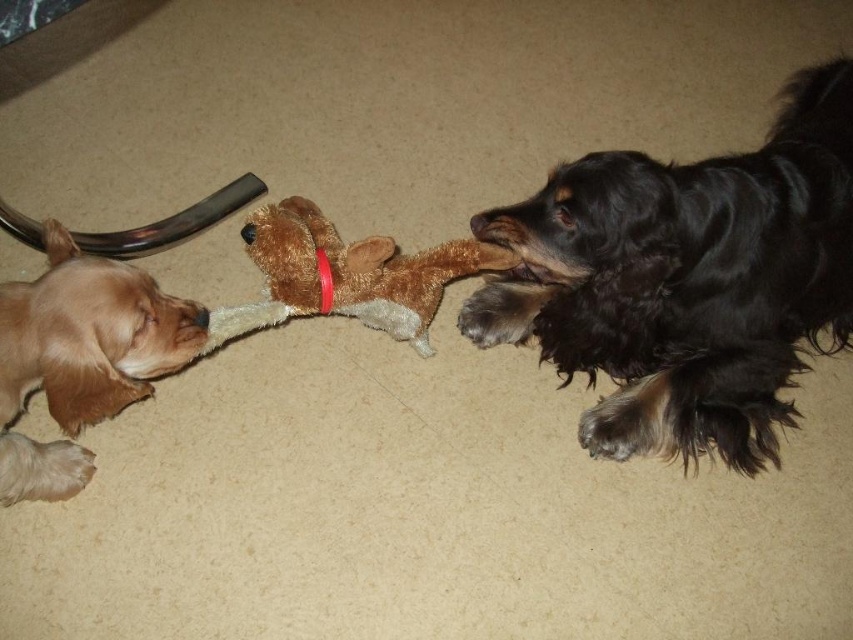
You are standing at the origin point of the coordinate system. You want to throw a treat to the black silky dog at right. What are the coordinates you should aim for?

The coordinates to aim for are 0.438 in the x direction and 0.805 in the y direction.

What are the coordinates of the black silky dog at right?

The black silky dog at right is located at coordinates point [686,280].

Based on the scene description, where is the light brown fur at left located in terms of its 2D coordinates?

The light brown fur at left is located at the 2D coordinates of point (80, 356).